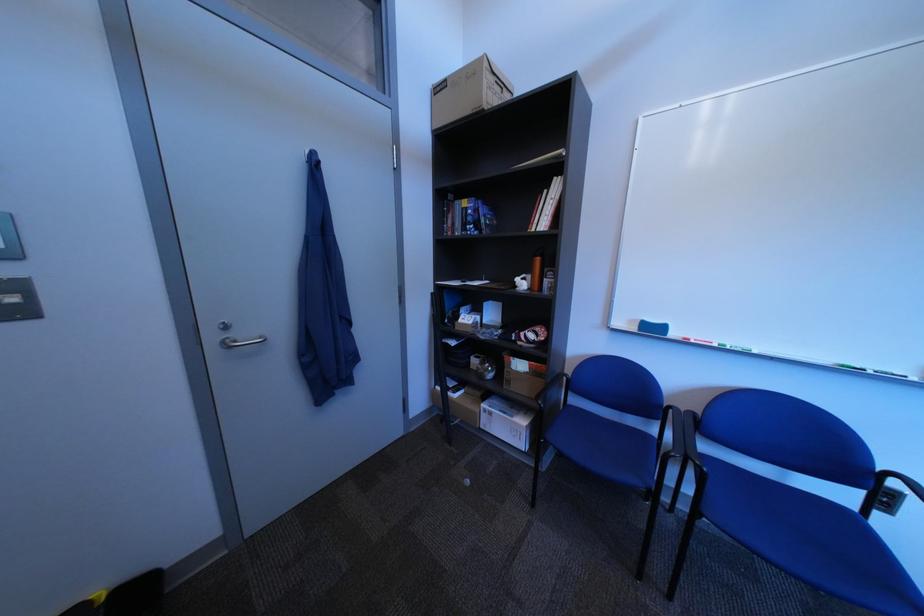
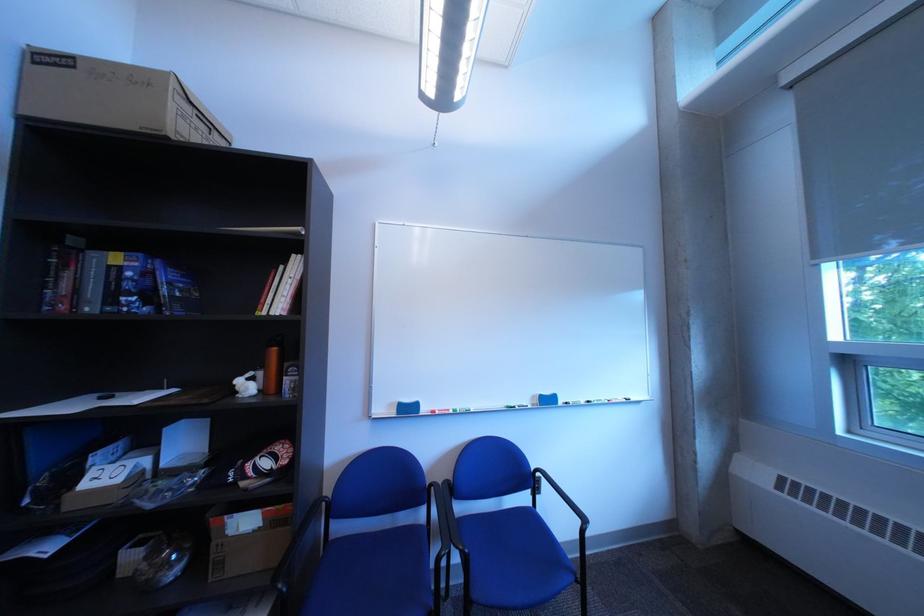
Locate, in the second image, the point that corresponds to (x=525, y=383) in the first image.

(237, 565)